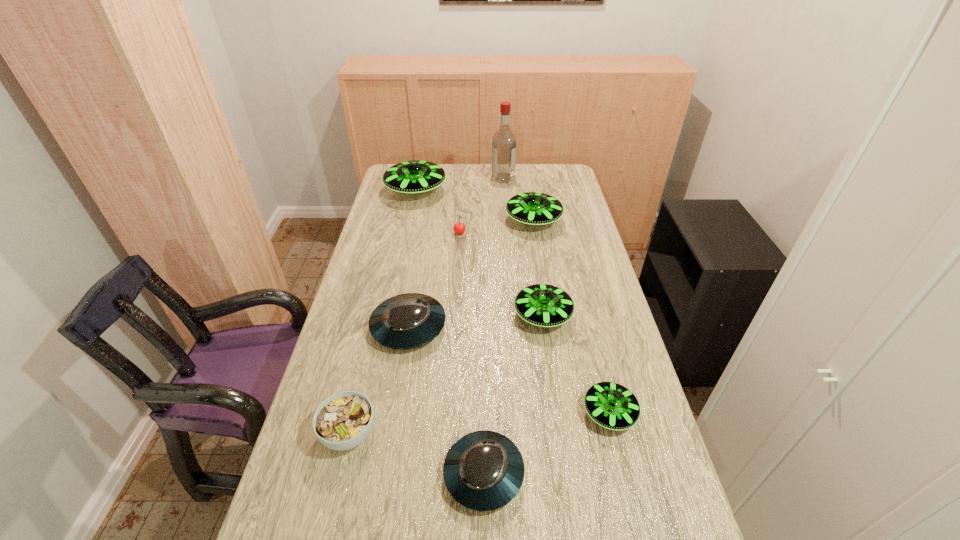
Where is `the fourth saucer from right to left`? the fourth saucer from right to left is located at coordinates (484, 470).

Find the location of a particular element. The image size is (960, 540). the right gray saucer is located at coordinates (484, 470).

The width and height of the screenshot is (960, 540). I want to click on vacant space located 0.330m on the front-facing side of the liquor, so click(x=419, y=178).

Locate an element on the screen. The height and width of the screenshot is (540, 960). vacant point located on the front-facing side of the liquor is located at coordinates (480, 178).

Where is `vacant space located on the front-facing side of the liquor`? vacant space located on the front-facing side of the liquor is located at coordinates (474, 178).

Identify the location of free space located 0.130m on the right of the tallest saucer. (477, 191).

Where is `vacant region located 0.320m on the front of the second biggest green saucer`? Image resolution: width=960 pixels, height=540 pixels. vacant region located 0.320m on the front of the second biggest green saucer is located at coordinates (545, 296).

The width and height of the screenshot is (960, 540). Identify the location of free spot located 0.310m on the left of the cherry. (372, 235).

This screenshot has height=540, width=960. Identify the location of blank space located on the front of the third biggest green saucer. (566, 474).

Image resolution: width=960 pixels, height=540 pixels. In order to click on vacant space situated on the back of the farther gray saucer in this screenshot , I will do `click(419, 268)`.